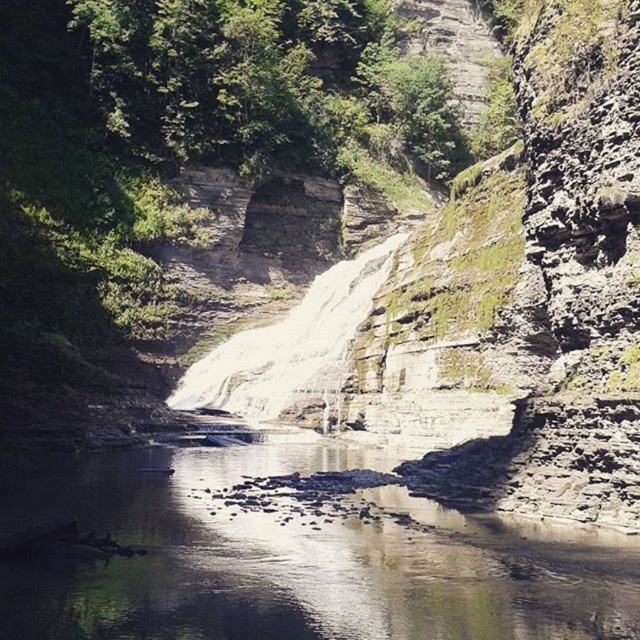
You are standing at the edge of the river and want to cross to the other side. The clear water at center is flowing smoothly. Where should you step to avoid the strongest current?

You should step away from the clear water at center, as it is located at point [292,560] and has the strongest current due to its central position in the river.

You are a hiker who wants to cross the river at the base of the waterfall. You see the clear water at center and the white smooth waterfall at center. Which one is the best path to cross the river safely?

The clear water at center is positioned under the white smooth waterfall at center, so the best path to cross the river safely would be the clear water at center since it is calmer and more stable for walking.

You are a hiker standing at point (476, 522). You want to cross the river to the other side. The river is 50.21 meters wide at this point. Can you safely cross it if your maximum safe crossing distance is 40 meters?

The river is 50.21 meters wide at this point, which exceeds your maximum safe crossing distance of 40 meters. Therefore, it is not safe to cross here.